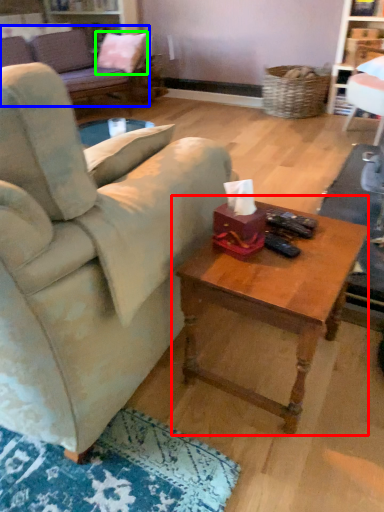
Question: Which object is positioned farthest from coffee table (highlighted by a red box)? Select from studio couch (highlighted by a blue box) and pillow (highlighted by a green box).

Choices:
 (A) studio couch
 (B) pillow

Answer: (B)